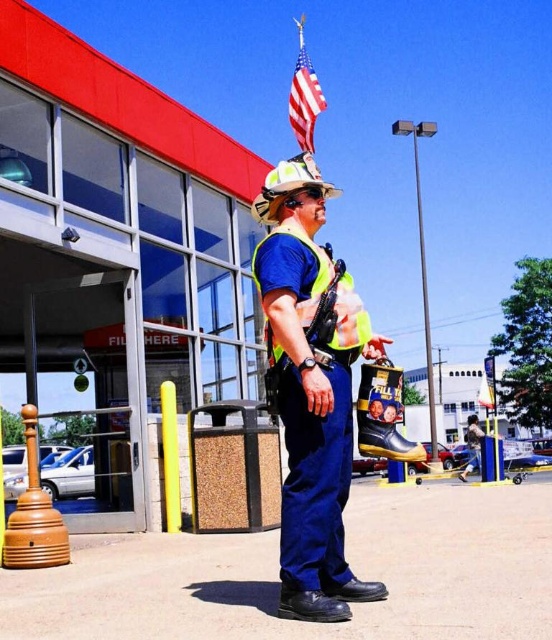
Between blue fabric uniform at center and yellow reflective safety vest at center, which one has less height?

yellow reflective safety vest at center

Can you confirm if blue fabric uniform at center is smaller than yellow reflective safety vest at center?

No.

Between point (336, 554) and point (305, 317), which one is positioned in front?

Point (305, 317) is more forward.

At what (x,y) coordinates should I click in order to perform the action: click on blue fabric uniform at center. Please return your answer as a coordinate pair (x, y). Looking at the image, I should click on (319, 465).

Between yellow reflective safety vest at center and blue denim jeans at center, which one appears on the right side from the viewer's perspective?

Positioned to the right is blue denim jeans at center.

Who is lower down, yellow reflective safety vest at center or blue denim jeans at center?

blue denim jeans at center

Is point (307, 241) less distant than point (470, 428)?

Yes, point (307, 241) is closer to viewer.

Locate an element on the screen. yellow reflective safety vest at center is located at coordinates point(293,268).

Is yellow reflective safety vest at center to the right of red fabric flag at upper center from the viewer's perspective?

In fact, yellow reflective safety vest at center is to the left of red fabric flag at upper center.

Which is behind, point (315, 288) or point (307, 116)?

The point (307, 116) is more distant.

You are a GUI agent. You are given a task and a screenshot of the screen. Output one action in this format:
    pyautogui.click(x=<x>, y=<y>)
    Task: Click on the yellow reflective safety vest at center
    Image resolution: width=552 pixels, height=640 pixels.
    Given the screenshot: What is the action you would take?
    pyautogui.click(x=293, y=268)